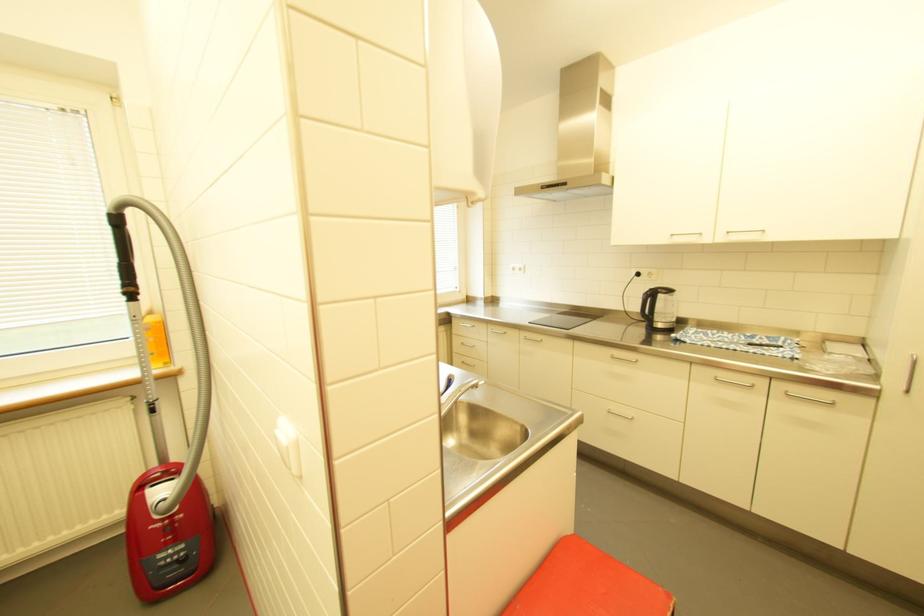
What do you see at coordinates (647, 305) in the screenshot? I see `a kettle handle` at bounding box center [647, 305].